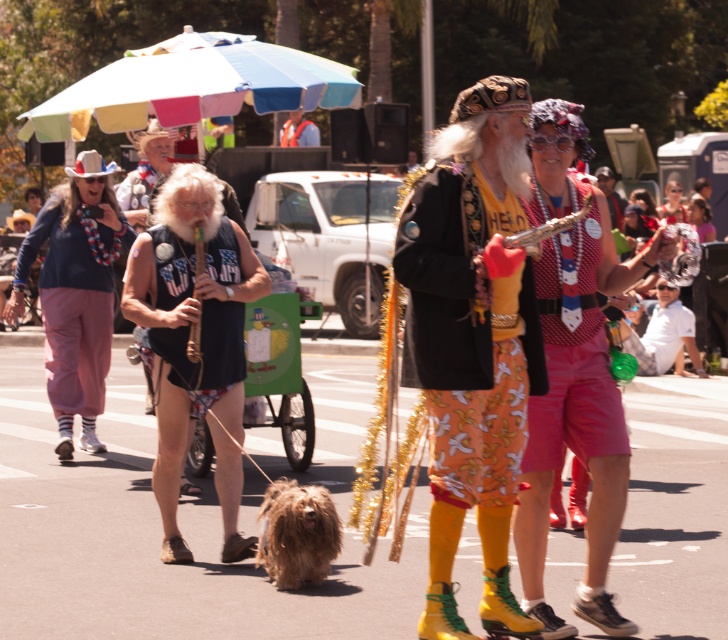
Question: Can you confirm if multicolored fabric umbrella at upper center is positioned to the left of matte white shirt at center?

Choices:
 (A) yes
 (B) no

Answer: (A)

Question: Which object is positioned farthest from the matte pink pants at left?

Choices:
 (A) matte red shorts at center
 (B) brown shaggy dog at center

Answer: (A)

Question: Which of the following is the farthest from the observer?

Choices:
 (A) matte red shorts at center
 (B) orange life vest at center
 (C) multicolored fabric umbrella at upper center
 (D) matte white shirt at center

Answer: (B)

Question: Which is nearer to the brown shaggy dog at center?

Choices:
 (A) multicolored fabric umbrella at upper center
 (B) floral cotton shorts at center

Answer: (B)

Question: Does black fabric vest at center appear on the right side of orange life vest at center?

Choices:
 (A) yes
 (B) no

Answer: (A)

Question: Is black fabric vest at center smaller than matte pink pants at left?

Choices:
 (A) no
 (B) yes

Answer: (B)